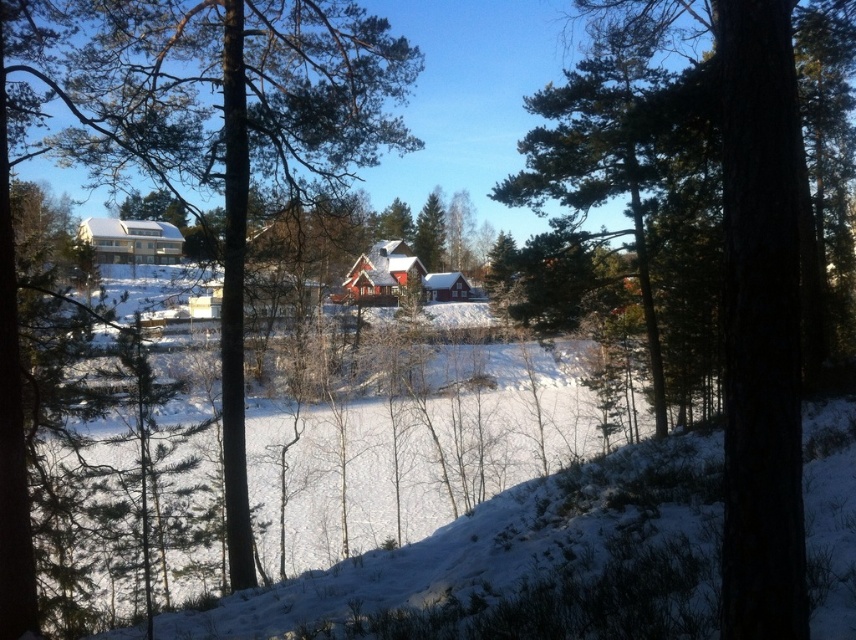
You are standing in the winter landscape and want to take a photo of both the white matte cabin at center and the red wooden cabin at center. Which cabin should you aim your camera upwards to include both in the frame?

You should aim your camera upwards to include both the white matte cabin at center and the red wooden cabin at center because the white matte cabin at center is above the red wooden cabin at center.

You are standing in front of the pine trees and see the red wooden cabin at center and the white wooden cabin at center. Which cabin is located to the left?

The red wooden cabin at center is positioned on the left side of white wooden cabin at center, so it is located to the left.

You are standing in the winter landscape and see both the white matte cabin at center and the red wooden cabin at center. Which cabin is positioned to the left when looking at them from your current viewpoint?

The white matte cabin at center is to the left of the red wooden cabin at center, so the white matte cabin at center is positioned to the left.